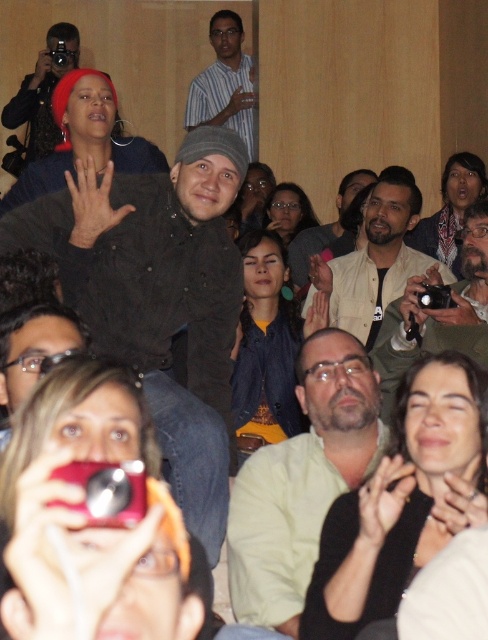
Between light green shirt at center and dark blue denim jacket at center, which one has less height?

With less height is light green shirt at center.

Is point (302, 387) positioned behind point (264, 298)?

No, it is in front of (264, 298).

Which is behind, point (292, 573) or point (255, 396)?

Positioned behind is point (255, 396).

At what (x,y) coordinates should I click in order to perform the action: click on light green shirt at center. Please return your answer as a coordinate pair (x, y). This screenshot has width=488, height=640. Looking at the image, I should click on (302, 481).

How distant is matte pink camera at lower left from matte green shirt at center?

matte pink camera at lower left and matte green shirt at center are 9.65 feet apart from each other.

Between matte pink camera at lower left and matte green shirt at center, which one has more height?

Standing taller between the two is matte green shirt at center.

Does point (138, 406) lie behind point (364, 556)?

No, (138, 406) is in front of (364, 556).

Identify the location of matte pink camera at lower left. The height and width of the screenshot is (640, 488). (81, 513).

In the scene shown: Between matte green shirt at center and matte black jacket at upper right, which one has more height?

With more height is matte green shirt at center.

Can you confirm if matte green shirt at center is bigger than matte black jacket at upper right?

Yes, matte green shirt at center is bigger than matte black jacket at upper right.

Between point (429, 387) and point (459, 161), which one is positioned in front?

Point (429, 387) is more forward.

You are a GUI agent. You are given a task and a screenshot of the screen. Output one action in this format:
    pyautogui.click(x=<x>, y=<y>)
    Task: Click on the matte green shirt at center
    Image resolution: width=488 pixels, height=640 pixels.
    Given the screenshot: What is the action you would take?
    click(398, 499)